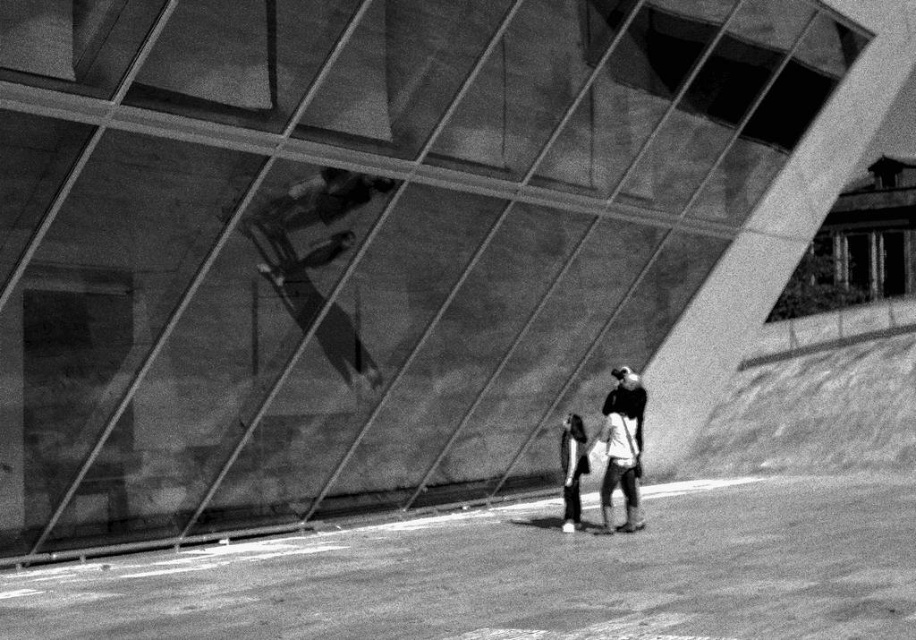
Is point (620, 417) farther from viewer compared to point (560, 433)?

No, it is in front of (560, 433).

Which is below, white cotton shirt at center or dark gray fabric jacket at lower center?

Positioned lower is dark gray fabric jacket at lower center.

This screenshot has width=916, height=640. I want to click on white cotton shirt at center, so click(x=622, y=448).

Is smooth black skateboard at center to the left of white cotton shirt at center from the viewer's perspective?

Correct, you'll find smooth black skateboard at center to the left of white cotton shirt at center.

You are a GUI agent. You are given a task and a screenshot of the screen. Output one action in this format:
    pyautogui.click(x=<x>, y=<y>)
    Task: Click on the smooth black skateboard at center
    Image resolution: width=916 pixels, height=640 pixels.
    Given the screenshot: What is the action you would take?
    pyautogui.click(x=346, y=349)

Is point (358, 348) closer to camera compared to point (614, 410)?

That is False.

At what (x,y) coordinates should I click in order to perform the action: click on smooth black skateboard at center. Please return your answer as a coordinate pair (x, y). The image size is (916, 640). Looking at the image, I should click on (346, 349).

Is smooth black skateboard at center wider than dark gray fabric jacket at lower center?

Correct, the width of smooth black skateboard at center exceeds that of dark gray fabric jacket at lower center.

Does smooth black skateboard at center come behind dark gray fabric jacket at lower center?

Yes, it is.

Between point (347, 332) and point (575, 436), which one is positioned behind?

Point (347, 332)

Image resolution: width=916 pixels, height=640 pixels. I want to click on smooth black skateboard at center, so click(x=346, y=349).